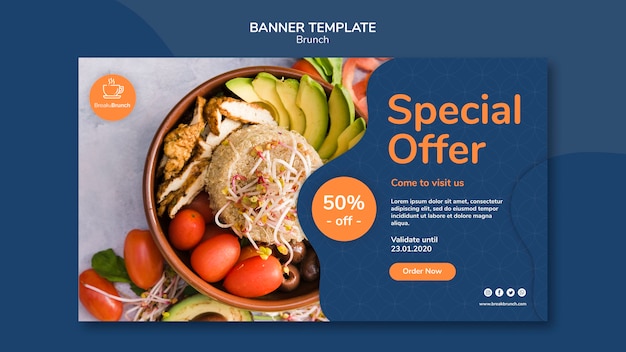
This screenshot has height=352, width=626. Find the location of `bowl`. bowl is located at coordinates (178, 269).